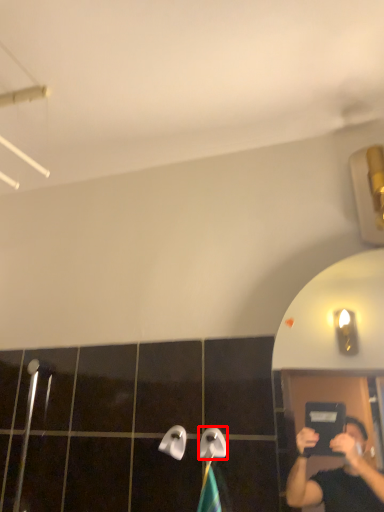
Question: From the image's perspective, what is the correct spatial positioning of towel bar (annotated by the red box) in reference to towel bar?

Choices:
 (A) below
 (B) above

Answer: (B)